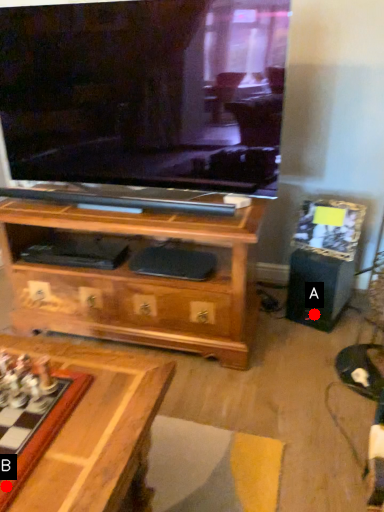
Question: Two points are circled on the image, labeled by A and B beside each circle. Which of the following is the closest to the observer?

Choices:
 (A) A is closer
 (B) B is closer

Answer: (B)